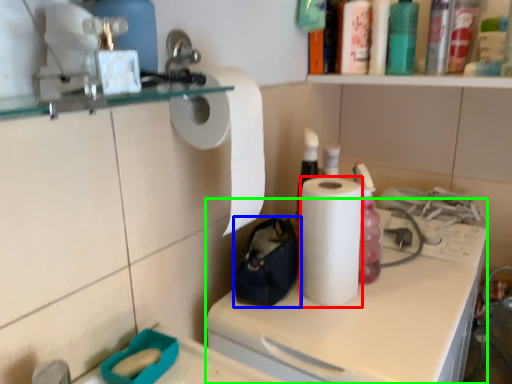
Question: Which object is positioned closest to paper towel (highlighted by a red box)? Select from pouch (highlighted by a blue box) and counter (highlighted by a green box).

Choices:
 (A) pouch
 (B) counter

Answer: (A)